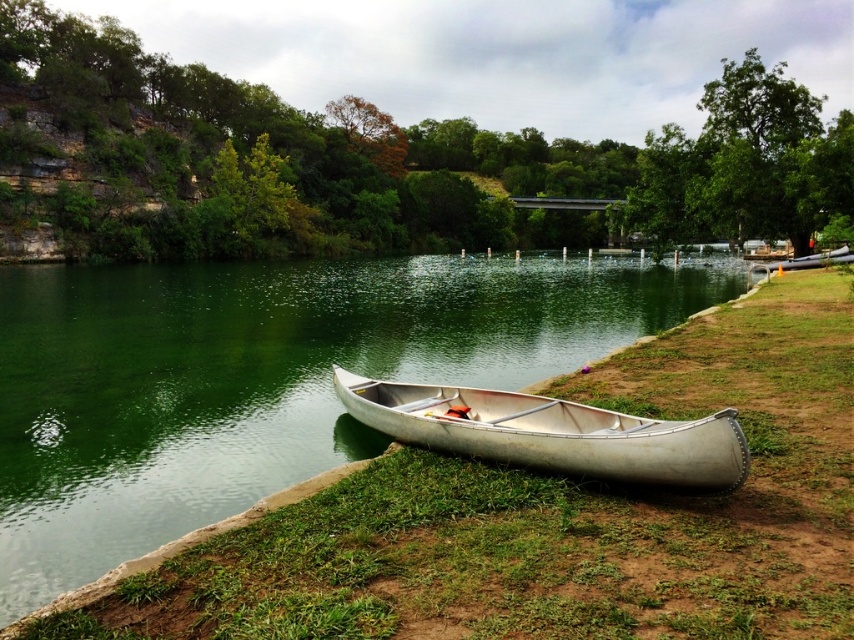
How far apart are green metallic river at lower left and silver metallic canoe at lower center?

They are 40.29 meters apart.

I want to click on green metallic river at lower left, so click(262, 378).

The width and height of the screenshot is (854, 640). Find the location of `green metallic river at lower left`. green metallic river at lower left is located at coordinates (262, 378).